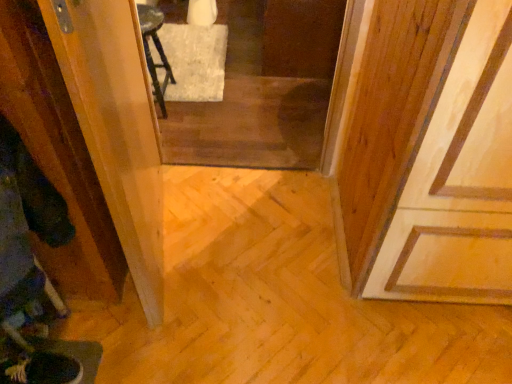
Locate an element on the screen. free space behind transparent plastic screen door at left, placed as the 2th screen door when sorted from right to left is located at coordinates [203, 193].